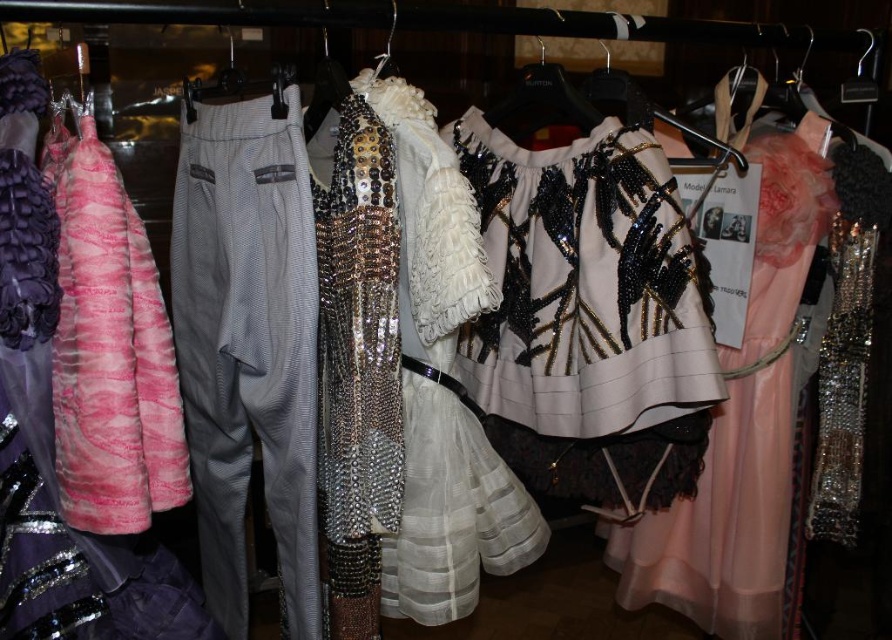
Between gray textured pants at left and pink fur coat at left, which one has less height?

Standing shorter between the two is pink fur coat at left.

Can you confirm if gray textured pants at left is positioned above pink fur coat at left?

Actually, gray textured pants at left is below pink fur coat at left.

This screenshot has width=892, height=640. Identify the location of gray textured pants at left. tap(248, 346).

Identify the location of gray textured pants at left. The width and height of the screenshot is (892, 640). (248, 346).

Between point (684, 316) and point (70, 436), which one is positioned in front?

Positioned in front is point (70, 436).

Can you confirm if white sequined blouse at center is smaller than pink fur coat at left?

Incorrect, white sequined blouse at center is not smaller in size than pink fur coat at left.

Identify the location of white sequined blouse at center. (589, 316).

Identify the location of white sequined blouse at center. (589, 316).

From the picture: Does gray textured pants at left have a lesser width compared to pale pink chiffon dress at center?

Yes.

Between gray textured pants at left and pale pink chiffon dress at center, which one appears on the right side from the viewer's perspective?

Positioned to the right is pale pink chiffon dress at center.

Between point (299, 102) and point (760, 204), which one is positioned in front?

Point (299, 102) is more forward.

At what (x,y) coordinates should I click in order to perform the action: click on gray textured pants at left. Please return your answer as a coordinate pair (x, y). Looking at the image, I should click on (248, 346).